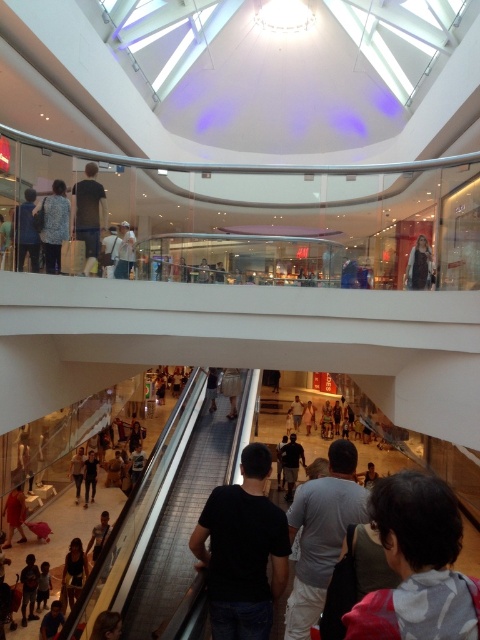
Question: Among these points, which one is nearest to the camera?

Choices:
 (A) (86, 189)
 (B) (74, 497)
 (C) (296, 400)

Answer: (A)

Question: Which point appears closest to the camera in this image?

Choices:
 (A) (412, 540)
 (B) (64, 586)

Answer: (A)

Question: Is fluffy blue jacket at upper left to the left of black cotton shirt at center from the viewer's perspective?

Choices:
 (A) no
 (B) yes

Answer: (B)

Question: Considering the relative positions of black matte t-shirt at center and dark gray shirt at center in the image provided, where is black matte t-shirt at center located with respect to dark gray shirt at center?

Choices:
 (A) below
 (B) above

Answer: (B)

Question: Does dark gray shirt at center lie in front of light beige skirt at center?

Choices:
 (A) yes
 (B) no

Answer: (A)

Question: Which object is positioned farthest from the light beige skirt at center?

Choices:
 (A) black matte t-shirt at center
 (B) gray hoodie at lower right
 (C) dark brown leather jacket at upper center
 (D) dark gray shirt at center

Answer: (B)